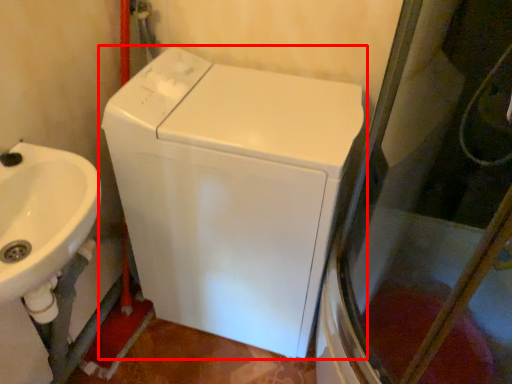
Question: In this image, where is washing machine (annotated by the red box) located relative to sink?

Choices:
 (A) right
 (B) left

Answer: (A)